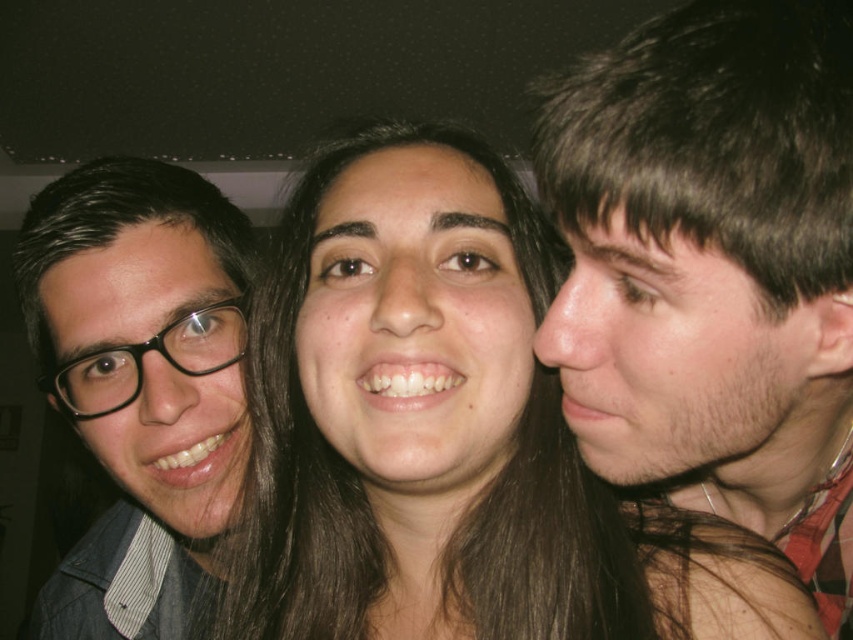
Question: Does smooth skin face at center appear on the left side of matte black glasses at left?

Choices:
 (A) yes
 (B) no

Answer: (B)

Question: Estimate the real-world distances between objects in this image. Which object is closer to the smooth skin face at right?

Choices:
 (A) matte black glasses at left
 (B) smooth skin face at center

Answer: (B)

Question: Can you confirm if smooth skin face at right is positioned to the left of smooth skin face at center?

Choices:
 (A) yes
 (B) no

Answer: (B)

Question: Does smooth skin face at right appear on the right side of matte black glasses at left?

Choices:
 (A) yes
 (B) no

Answer: (A)

Question: Which of these objects is positioned closest to the smooth skin face at center?

Choices:
 (A) matte black glasses at left
 (B) smooth skin face at right

Answer: (B)

Question: Which of the following is the farthest from the observer?

Choices:
 (A) (67, 205)
 (B) (759, 259)
 (C) (476, 314)

Answer: (A)